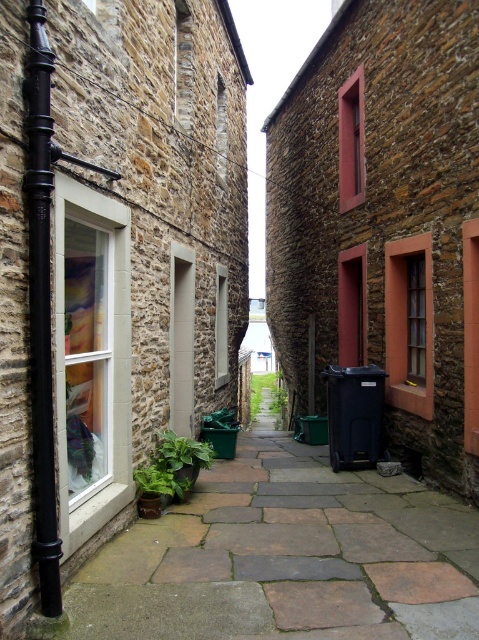
Question: Which point is farther to the camera?

Choices:
 (A) (250, 401)
 (B) (191, 460)

Answer: (A)

Question: Which point is closer to the camera taking this photo?

Choices:
 (A) (269, 376)
 (B) (149, 490)

Answer: (B)

Question: Does green matte plant at lower left appear over green leafy plant at center?

Choices:
 (A) no
 (B) yes

Answer: (B)

Question: Can you confirm if green matte plant at lower left is smaller than green leafy plant at center?

Choices:
 (A) yes
 (B) no

Answer: (A)

Question: Is green matte plant at lower left below green leafy plant at center?

Choices:
 (A) yes
 (B) no

Answer: (B)